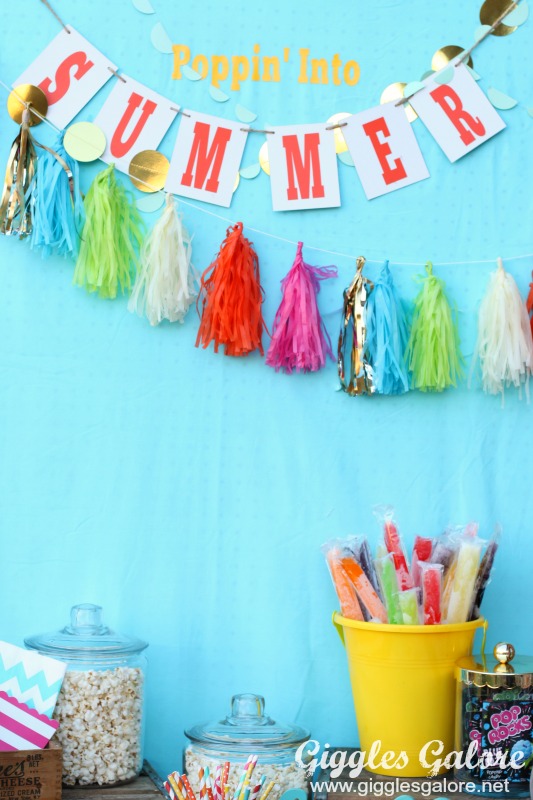
Locate an element on the screen. The width and height of the screenshot is (533, 800). letters on the banner is located at coordinates (71, 102), (147, 148), (214, 184), (309, 193), (212, 158), (313, 184), (410, 172), (461, 130).